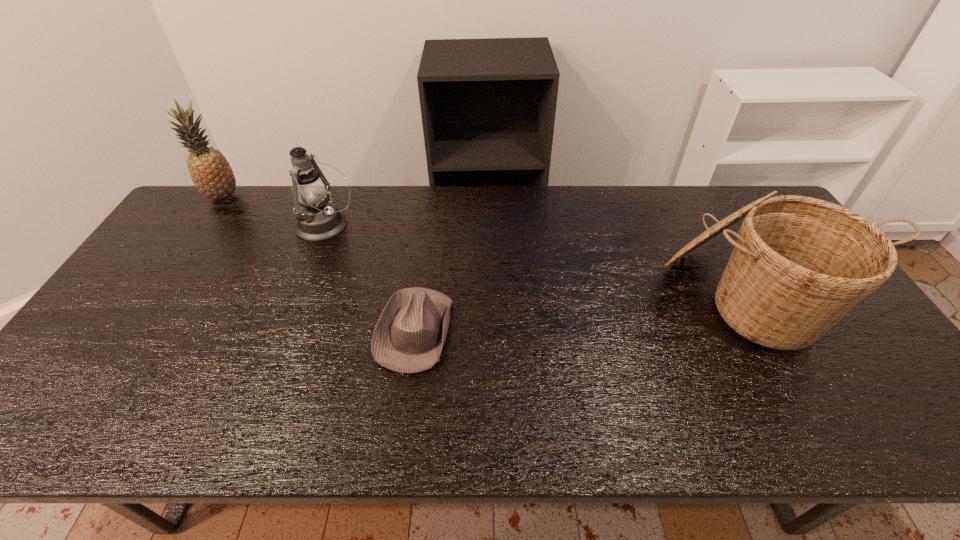
In order to click on free space at the far right corner of the desktop in this screenshot , I will do `click(750, 190)`.

Where is `free space at the near right corner of the desktop`? The width and height of the screenshot is (960, 540). free space at the near right corner of the desktop is located at coordinates (903, 417).

Locate an element on the screen. Image resolution: width=960 pixels, height=540 pixels. free space between the oil lamp and the farthest object is located at coordinates [275, 211].

Locate an element on the screen. vacant space that's between the pineapple and the third object from right to left is located at coordinates (275, 211).

Where is `blank region between the fedora and the leftmost object`? This screenshot has height=540, width=960. blank region between the fedora and the leftmost object is located at coordinates (319, 264).

Find the location of a particular element. The height and width of the screenshot is (540, 960). free point between the second farthest object and the pineapple is located at coordinates (275, 211).

Image resolution: width=960 pixels, height=540 pixels. Find the location of `free space between the farthest object and the rightmost object`. free space between the farthest object and the rightmost object is located at coordinates (486, 247).

The width and height of the screenshot is (960, 540). Identify the location of vacant point located between the shortest object and the third object from right to left. (370, 278).

At what (x,y) coordinates should I click in order to perform the action: click on vacant point located between the leftmost object and the basket. Please return your answer as a coordinate pair (x, y). The width and height of the screenshot is (960, 540). Looking at the image, I should click on (486, 247).

Where is `vacant space in between the rightmost object and the shortest object`? vacant space in between the rightmost object and the shortest object is located at coordinates (581, 313).